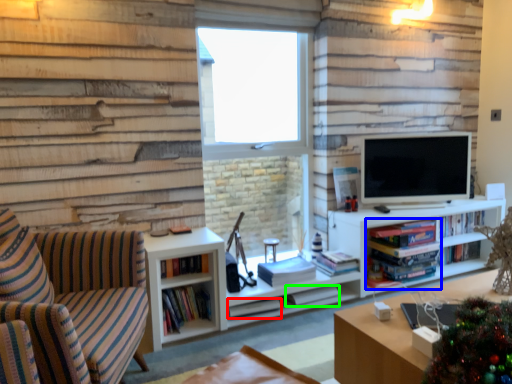
Question: Considering the real-world distances, which object is farthest from book (highlighted by a red box)? book (highlighted by a blue box) or book (highlighted by a green box)?

Choices:
 (A) book
 (B) book

Answer: (A)